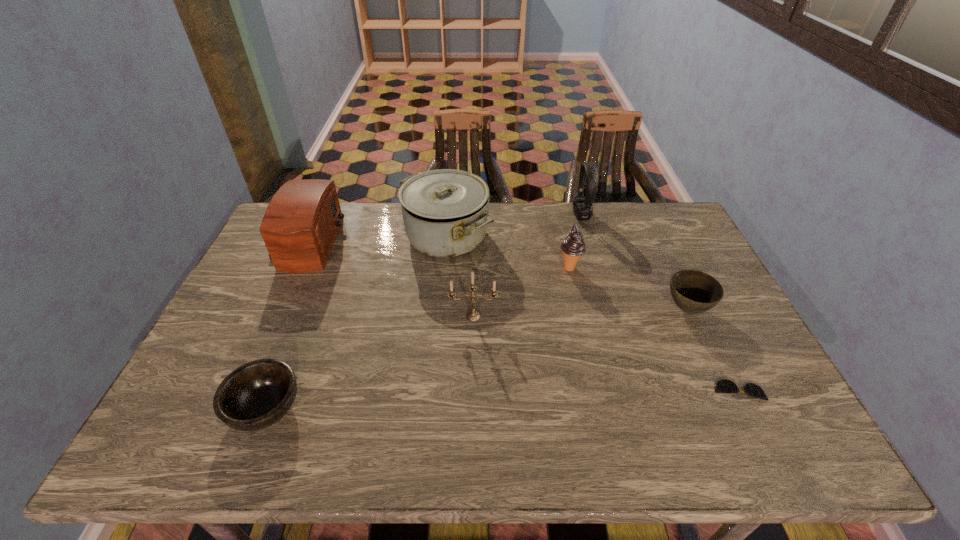
Where is `free spot located on the front-facing side of the sixth object from left to right`? free spot located on the front-facing side of the sixth object from left to right is located at coordinates (545, 215).

The image size is (960, 540). What are the coordinates of `vacant space situated on the front-facing side of the sixth object from left to right` in the screenshot? It's located at (474, 215).

Where is `vacant space located 0.110m on the right of the saucepan`? The height and width of the screenshot is (540, 960). vacant space located 0.110m on the right of the saucepan is located at coordinates (525, 237).

Where is `vacant region located 0.340m on the front-facing side of the radio receiver`? This screenshot has width=960, height=540. vacant region located 0.340m on the front-facing side of the radio receiver is located at coordinates [x=441, y=243].

Image resolution: width=960 pixels, height=540 pixels. I want to click on free space located 0.230m on the right of the candle, so (579, 316).

Locate an element on the screen. The width and height of the screenshot is (960, 540). blank area located 0.120m on the left of the fifth object from left to right is located at coordinates (519, 267).

Where is `free space located 0.300m on the front of the farther bowl`? The width and height of the screenshot is (960, 540). free space located 0.300m on the front of the farther bowl is located at coordinates (742, 427).

Find the location of a particular element. The width and height of the screenshot is (960, 540). vacant point located 0.130m on the back of the left bowl is located at coordinates (295, 337).

Find the location of a particular element. This screenshot has height=540, width=960. blank space located 0.210m on the back of the shortest object is located at coordinates (703, 318).

Locate an element on the screen. The width and height of the screenshot is (960, 540). headset that is at the far edge is located at coordinates (583, 207).